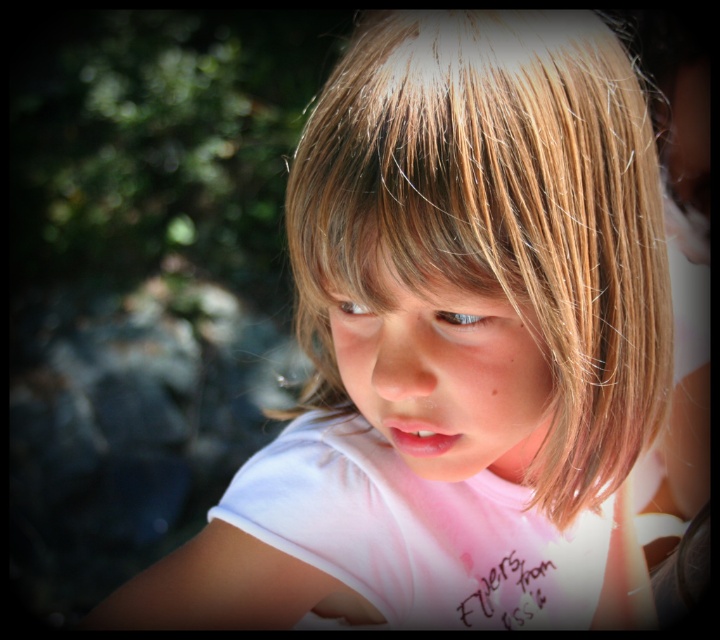
You are a photographer adjusting the focus of your camera. The subject has a smooth skin face at center and a brown matte eye at center. To ensure both are in focus, what should you adjust?

Since the smooth skin face at center is only 2.86 inches away from the brown matte eye at center, adjusting the aperture to a smaller opening will increase the depth of field, allowing both the smooth skin face at center and the brown matte eye at center to be in focus.

Based on the scene description, can you determine which object is larger between the smooth skin face at center and the blue glossy eye at center?

The smooth skin face at center is bigger than blue glossy eye at center according to the description.